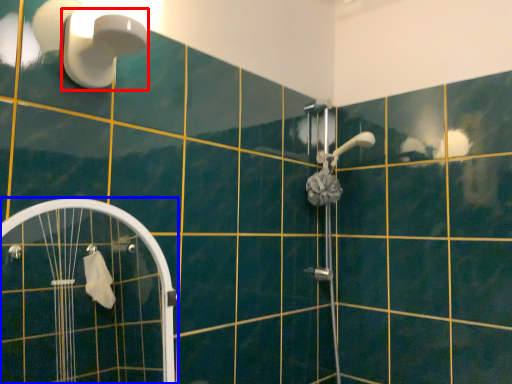
Question: Which of the following is the farthest to the observer, shower (highlighted by a red box) or screen door (highlighted by a blue box)?

Choices:
 (A) shower
 (B) screen door

Answer: (A)